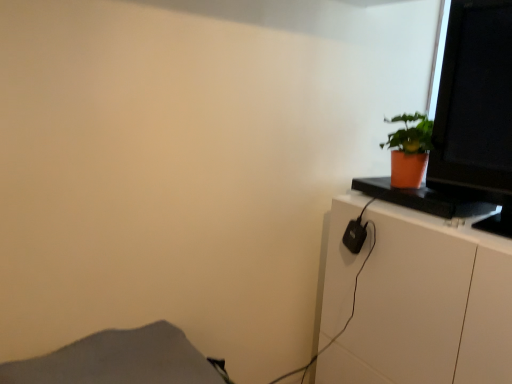
Question: Is gray fabric at lower left positioned beyond the bounds of matte black monitor at upper right?

Choices:
 (A) no
 (B) yes

Answer: (B)

Question: Could matte black monitor at upper right be considered to be inside gray fabric at lower left?

Choices:
 (A) no
 (B) yes

Answer: (A)

Question: From the image's perspective, is gray fabric at lower left under matte black monitor at upper right?

Choices:
 (A) yes
 (B) no

Answer: (A)

Question: Is gray fabric at lower left positioned with its back to matte black monitor at upper right?

Choices:
 (A) yes
 (B) no

Answer: (B)

Question: From the image's perspective, is gray fabric at lower left on matte black monitor at upper right?

Choices:
 (A) no
 (B) yes

Answer: (A)

Question: In the image, is gray fabric at lower left positioned in front of or behind matte black monitor at upper right?

Choices:
 (A) behind
 (B) front

Answer: (B)

Question: In terms of width, does gray fabric at lower left look wider or thinner when compared to matte black monitor at upper right?

Choices:
 (A) thin
 (B) wide

Answer: (B)

Question: From their relative heights in the image, would you say gray fabric at lower left is taller or shorter than matte black monitor at upper right?

Choices:
 (A) tall
 (B) short

Answer: (B)

Question: Considering the positions of gray fabric at lower left and matte black monitor at upper right in the image, is gray fabric at lower left bigger or smaller than matte black monitor at upper right?

Choices:
 (A) big
 (B) small

Answer: (B)

Question: In the image, is matte black monitor at upper right positioned in front of or behind white glossy cabinet at right?

Choices:
 (A) front
 (B) behind

Answer: (B)

Question: In terms of height, does matte black monitor at upper right look taller or shorter compared to white glossy cabinet at right?

Choices:
 (A) tall
 (B) short

Answer: (B)

Question: Considering the positions of matte black monitor at upper right and white glossy cabinet at right in the image, is matte black monitor at upper right wider or thinner than white glossy cabinet at right?

Choices:
 (A) wide
 (B) thin

Answer: (B)

Question: Is point (496, 1) closer or farther from the camera than point (356, 342)?

Choices:
 (A) closer
 (B) farther

Answer: (A)

Question: From a real-world perspective, is white glossy cabinet at right above or below matte black monitor at upper right?

Choices:
 (A) above
 (B) below

Answer: (B)

Question: Considering the positions of white glossy cabinet at right and matte black monitor at upper right in the image, is white glossy cabinet at right taller or shorter than matte black monitor at upper right?

Choices:
 (A) short
 (B) tall

Answer: (B)